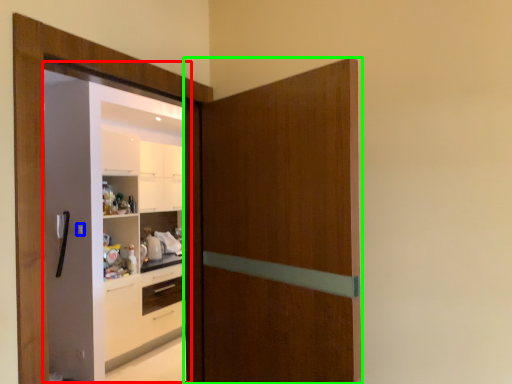
Question: Which object is positioned closest to screen door (highlighted by a red box)? Select from door handle (highlighted by a blue box) and door (highlighted by a green box).

Choices:
 (A) door handle
 (B) door

Answer: (A)